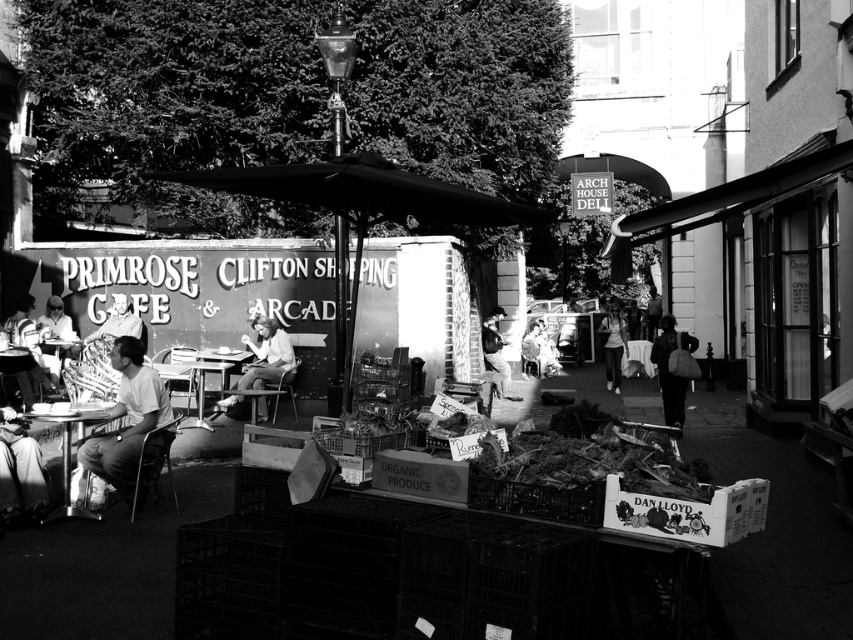
Can you confirm if light gray t-shirt at lower left is thinner than light brown fabric jacket at center?

Correct, light gray t-shirt at lower left's width is less than light brown fabric jacket at center's.

Does light gray t-shirt at lower left have a greater height compared to light brown fabric jacket at center?

Incorrect, light gray t-shirt at lower left's height is not larger of light brown fabric jacket at center's.

Between point (115, 467) and point (611, 298), which one is positioned behind?

The point (611, 298) is behind.

The image size is (853, 640). What are the coordinates of `light gray t-shirt at lower left` in the screenshot? It's located at (131, 428).

Can you confirm if metallic silver table at lower left is positioned below light brown fabric jacket at center?

Correct, metallic silver table at lower left is located below light brown fabric jacket at center.

Is point (76, 515) less distant than point (614, 376)?

Yes, it is in front of point (614, 376).

Find the location of `metallic silver table at lower left`. metallic silver table at lower left is located at coordinates (70, 458).

Which of these two, dark fabric bag at center or light brown fabric jacket at center, stands taller?

light brown fabric jacket at center

Which is above, dark fabric bag at center or light brown fabric jacket at center?

light brown fabric jacket at center is above.

Is point (670, 384) behind point (605, 372)?

No, it is not.

Find the location of `dark fabric bag at center`. dark fabric bag at center is located at coordinates (669, 371).